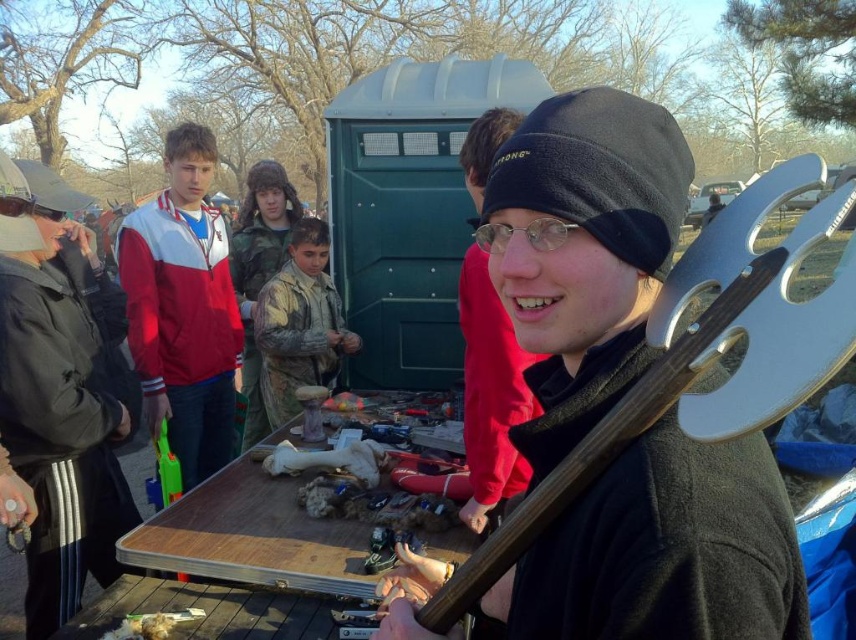
You are a photographer taking a picture of the matte black beanie at upper center and the camouflage fabric boy at center. Which object is higher in the frame?

The matte black beeanie at upper center is taller than the camouflage fabric boy at center, so the matte black beanie at upper center is higher in the frame.

You are standing at the camera position and want to hand a gift to the person wearing the matte black beanie at upper center. The gift is 1.8 meters long. Can you reach them without moving?

The matte black beanie at upper center is 2.04 meters from the camera. Since the gift is 1.8 meters long, you cannot reach them without moving closer.

You are a photographer setting up for an event. You notice the wooden table at center and the camouflage fabric boy at center. Which object is positioned lower in the scene?

The wooden table at center is positioned lower than the camouflage fabric boy at center.